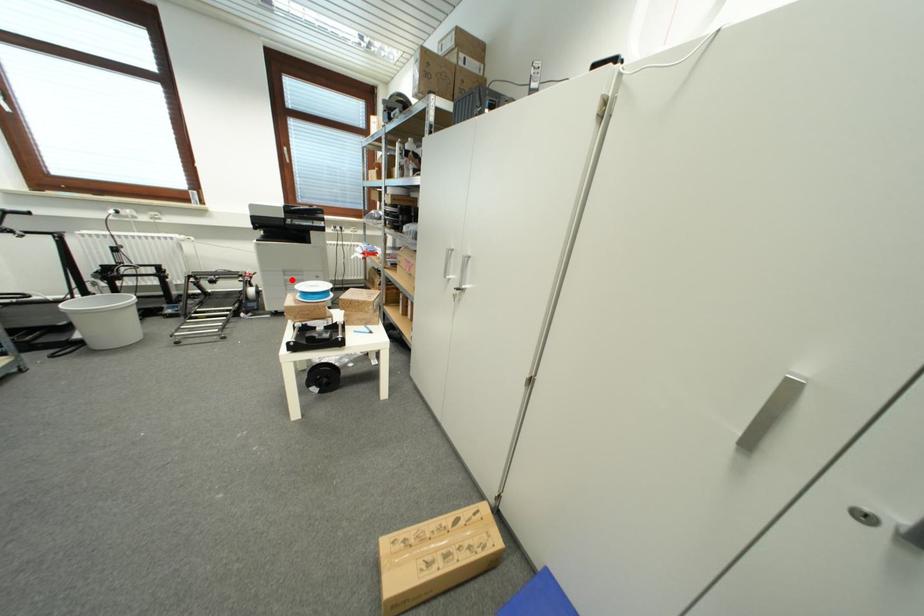
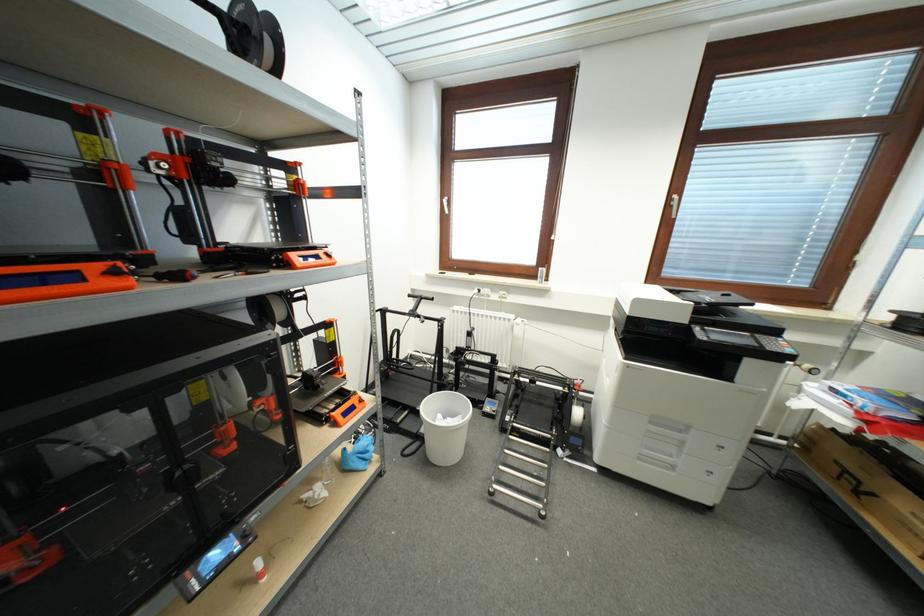
Locate, in the second image, the point that corresponds to the highlighted location in the first image.

(658, 431)